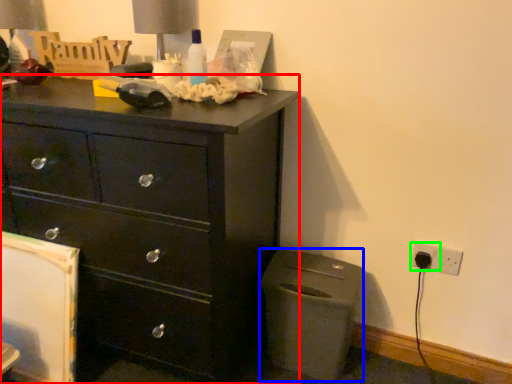
Question: Which is nearer to the chest of drawers (highlighted by a red box)? cabinetry (highlighted by a blue box) or electric outlet (highlighted by a green box).

Choices:
 (A) cabinetry
 (B) electric outlet

Answer: (A)